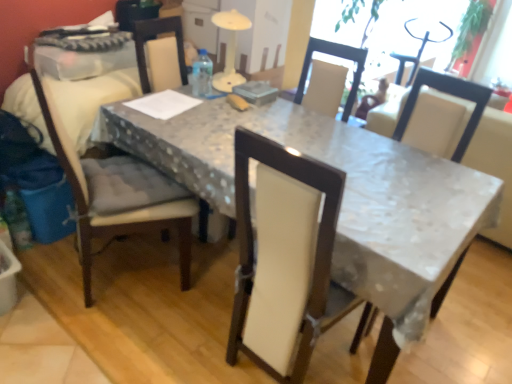
Question: Can you confirm if white glossy table at center is shorter than matte beige cushioned chair at left, which is the first chair from left to right?

Choices:
 (A) no
 (B) yes

Answer: (B)

Question: Would you say white glossy table at center is a long distance from matte beige cushioned chair at left, the 2th chair when ordered from right to left?

Choices:
 (A) no
 (B) yes

Answer: (A)

Question: Is matte beige cushioned chair at left, which is the first chair from left to right, a part of white glossy table at center?

Choices:
 (A) no
 (B) yes

Answer: (B)

Question: From a real-world perspective, is white glossy table at center located higher than matte beige cushioned chair at left, which is the first chair from left to right?

Choices:
 (A) yes
 (B) no

Answer: (B)

Question: Is white glossy table at center to the right of matte beige cushioned chair at left, the 2th chair when ordered from right to left, from the viewer's perspective?

Choices:
 (A) yes
 (B) no

Answer: (A)

Question: Is point (231, 117) positioned closer to the camera than point (463, 52)?

Choices:
 (A) farther
 (B) closer

Answer: (B)

Question: Is white glossy table at center bigger or smaller than green leafy plant at upper right?

Choices:
 (A) small
 (B) big

Answer: (B)

Question: In terms of height, does white glossy table at center look taller or shorter compared to green leafy plant at upper right?

Choices:
 (A) tall
 (B) short

Answer: (B)

Question: Visually, is white glossy table at center positioned to the left or to the right of green leafy plant at upper right?

Choices:
 (A) right
 (B) left

Answer: (B)

Question: From their relative heights in the image, would you say matte beige cushioned chair at left, the 2th chair when ordered from right to left, is taller or shorter than white fabric chair at center, positioned as the 1th chair in right-to-left order?

Choices:
 (A) tall
 (B) short

Answer: (A)

Question: From the image's perspective, relative to white fabric chair at center, the 2th chair when ordered from left to right, is matte beige cushioned chair at left, the 2th chair when ordered from right to left, above or below?

Choices:
 (A) below
 (B) above

Answer: (B)

Question: Is matte beige cushioned chair at left, which is the first chair from left to right, bigger or smaller than white fabric chair at center, the 2th chair when ordered from left to right?

Choices:
 (A) big
 (B) small

Answer: (A)

Question: From a real-world perspective, is matte beige cushioned chair at left, the 2th chair when ordered from right to left, positioned above or below white fabric chair at center, the 2th chair when ordered from left to right?

Choices:
 (A) below
 (B) above

Answer: (A)

Question: Considering their positions, is matte beige cushioned chair at left, which is the first chair from left to right, located in front of or behind white glossy table at center?

Choices:
 (A) front
 (B) behind

Answer: (B)

Question: From the image's perspective, is matte beige cushioned chair at left, the 2th chair when ordered from right to left, above or below white glossy table at center?

Choices:
 (A) above
 (B) below

Answer: (A)